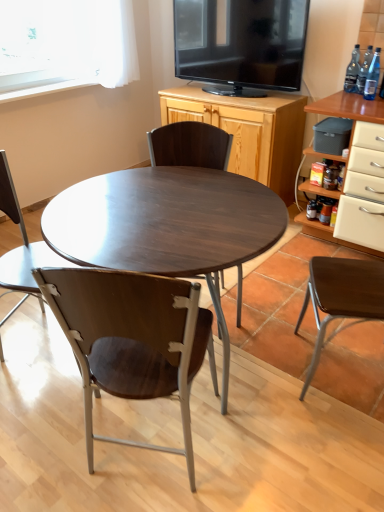
Find the location of a particular element. The width and height of the screenshot is (384, 512). vacant space in front of clear glass bottle at upper right, the 1th bottle from the back is located at coordinates (352, 95).